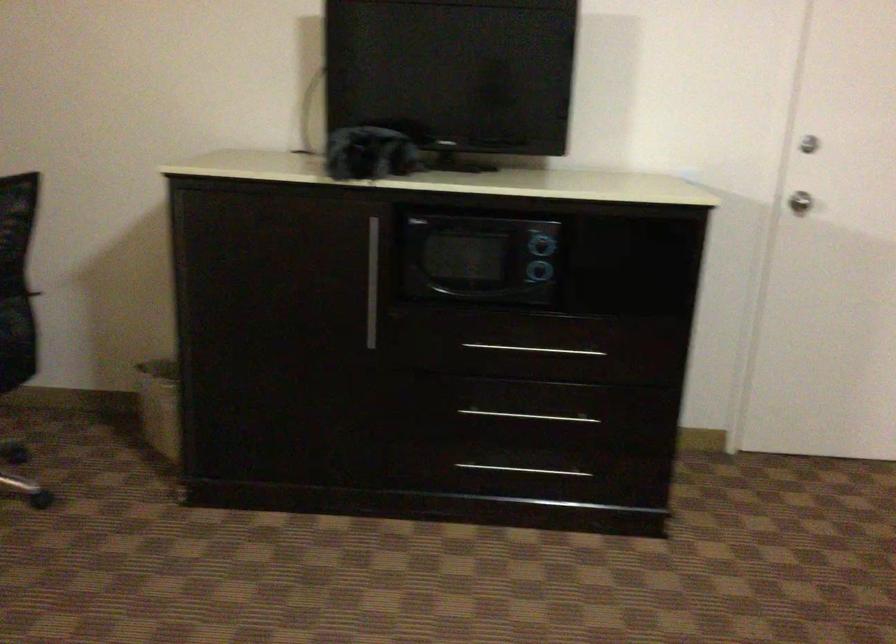
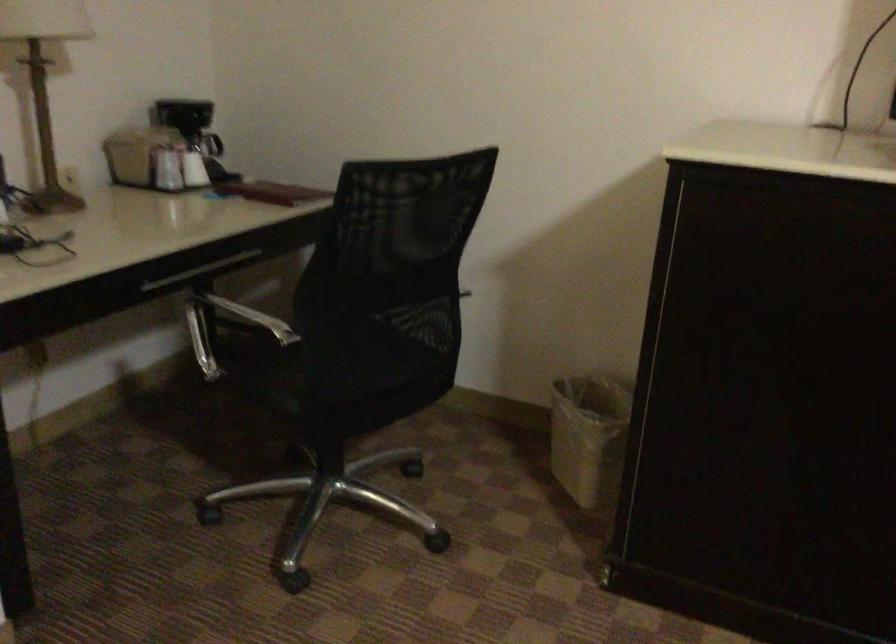
Question: The first image is from the beginning of the video and the second image is from the end. How did the camera likely rotate when shooting the video?

Choices:
 (A) Left
 (B) Right
 (C) Up
 (D) Down

Answer: (A)